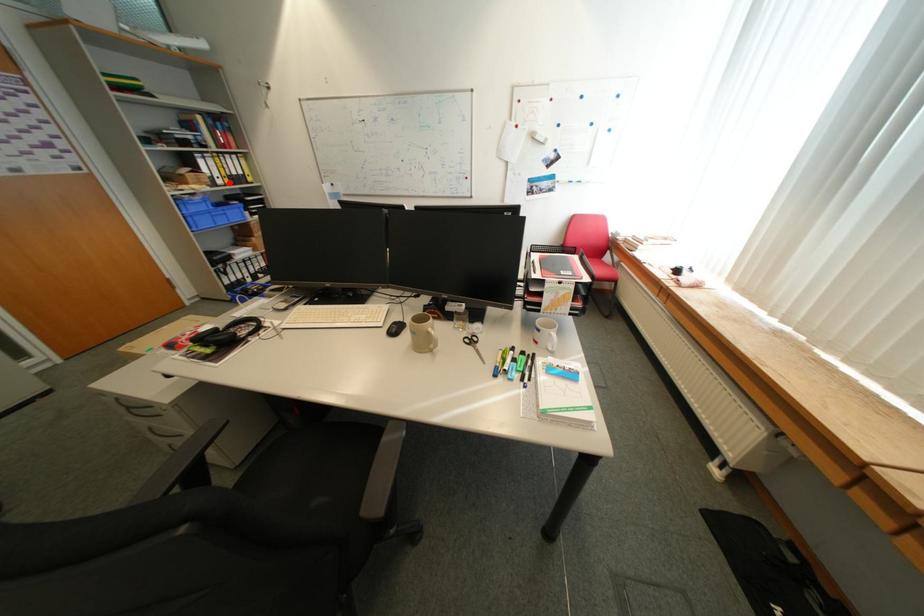
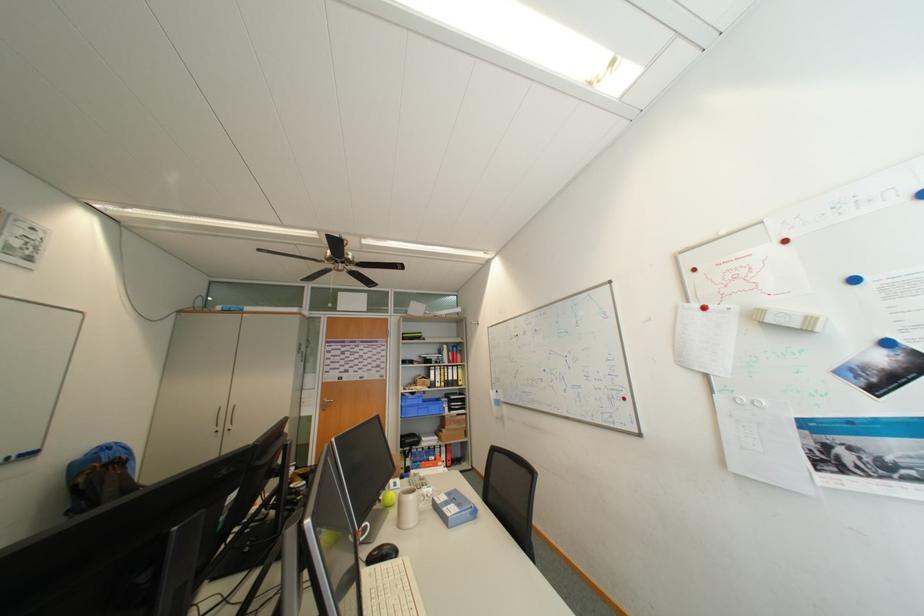
Locate, in the second image, the point that corresponds to the highlighted location in the first image.

(447, 386)